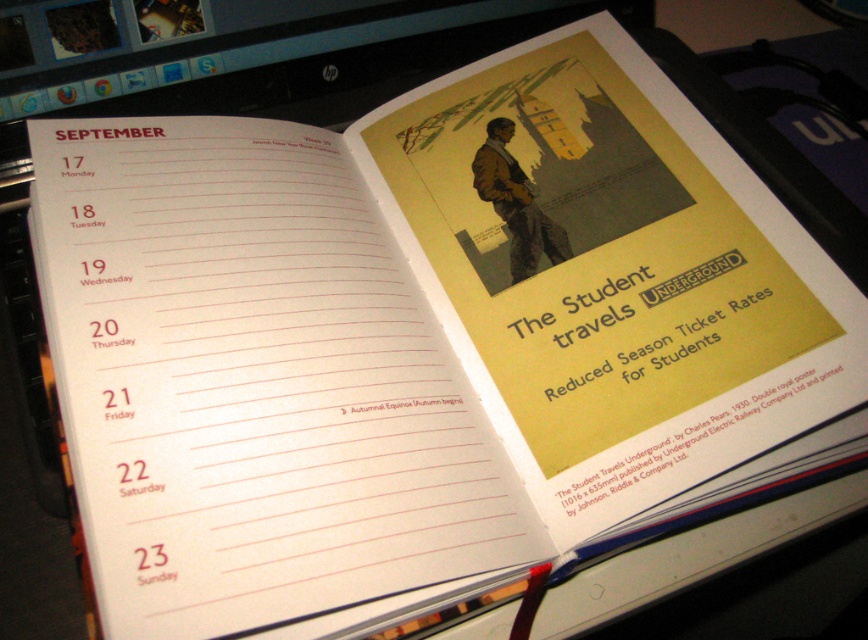
You are organizing a study session and need to place both the yellow paper at upper right and the yellow paper poster at upper right on a bulletin board. Based on their positions in the image, which one should you place first to ensure they can both fit on the board without overlapping?

The yellow paper at upper right is positioned under the yellow paper poster at upper right, so you should place the yellow paper poster at upper right first to make space for the yellow paper at upper right underneath it.

You are organizing a study session and need to place both the yellow paper at upper right and the yellow paper poster at upper right on a shelf. Which one should you place first to ensure they both fit?

The yellow paper at upper right might be wider than yellow paper poster at upper right, so you should place the wider one first to ensure both fit on the shelf.